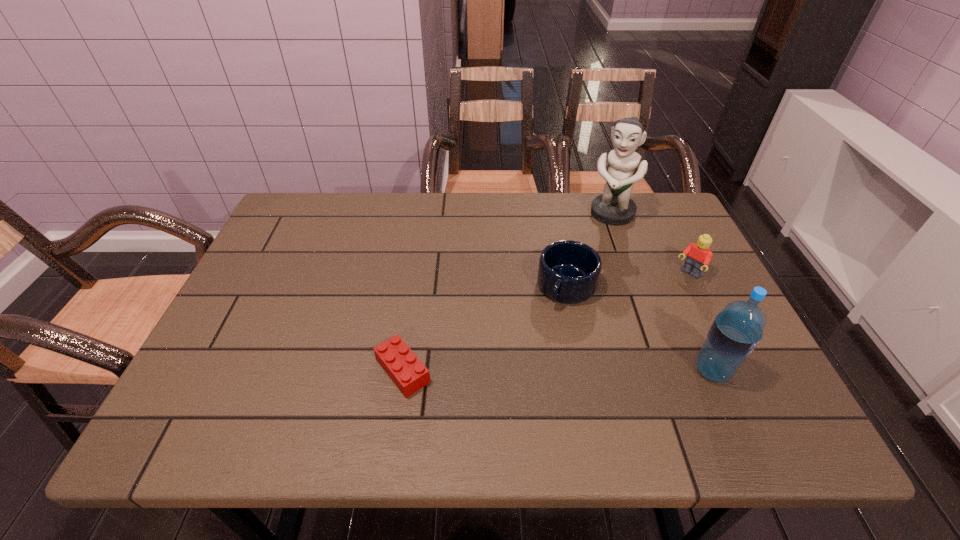
Image resolution: width=960 pixels, height=540 pixels. In order to click on object positioned at the far edge in this screenshot , I will do `click(614, 207)`.

Identify the location of Lego at the near edge. 409,374.

Image resolution: width=960 pixels, height=540 pixels. I want to click on water bottle at the near edge, so click(737, 329).

Image resolution: width=960 pixels, height=540 pixels. In order to click on water bottle situated at the right edge in this screenshot , I will do [x=737, y=329].

The width and height of the screenshot is (960, 540). Find the location of `Lego present at the right edge`. Lego present at the right edge is located at coordinates (699, 255).

Where is `figurine located in the right edge section of the desktop`? figurine located in the right edge section of the desktop is located at coordinates (614, 207).

Identify the location of object present at the far right corner. The width and height of the screenshot is (960, 540). (614, 207).

Locate an element on the screen. Image resolution: width=960 pixels, height=540 pixels. object that is at the near right corner is located at coordinates (737, 329).

Image resolution: width=960 pixels, height=540 pixels. In the image, there is a desktop. Find the location of `free space at the far edge`. free space at the far edge is located at coordinates (377, 240).

Identify the location of free space at the near edge. (648, 394).